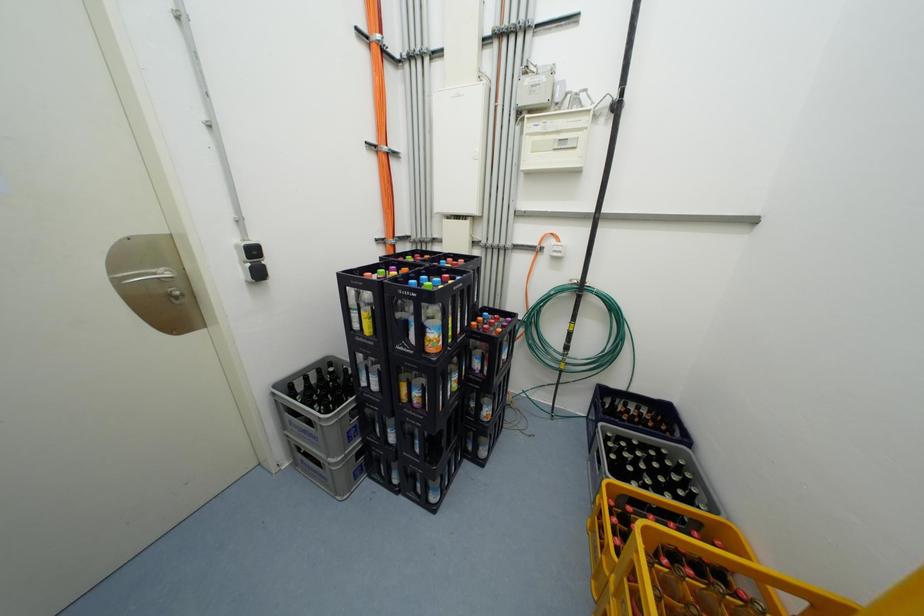
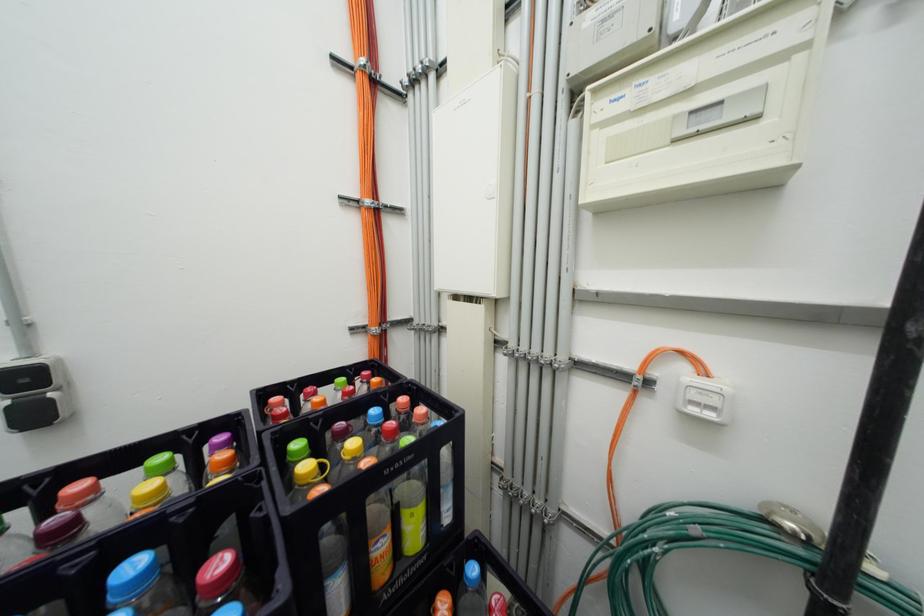
Question: How did the camera likely rotate?

Choices:
 (A) Left
 (B) Right
 (C) Up
 (D) Down

Answer: (A)